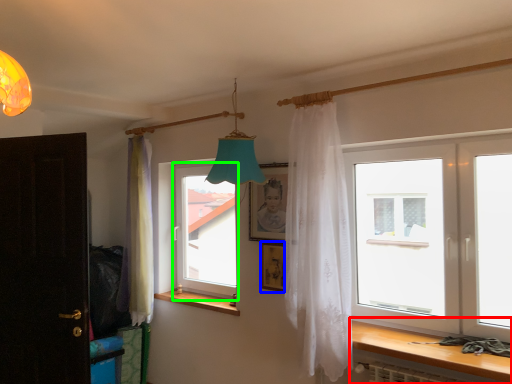
Question: Which object is the farthest from table (highlighted by a red box)? Choose among these: picture frame (highlighted by a blue box) or window (highlighted by a green box).

Choices:
 (A) picture frame
 (B) window

Answer: (B)